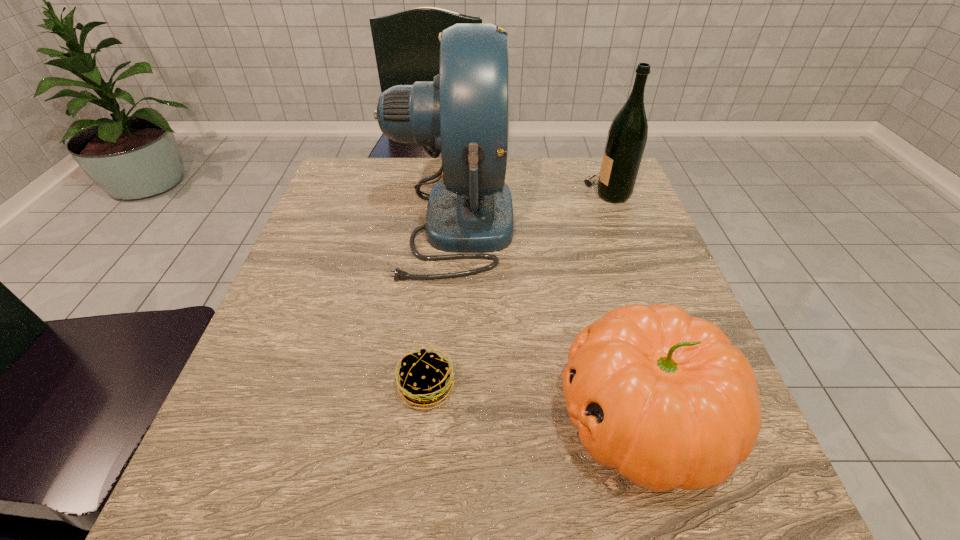
Locate an element on the screen. Image resolution: width=960 pixels, height=540 pixels. fan is located at coordinates [x=463, y=114].

You are a GUI agent. You are given a task and a screenshot of the screen. Output one action in this format:
    pyautogui.click(x=<x>, y=<y>)
    Task: Click on the second tallest object
    The image size is (960, 540).
    Given the screenshot: What is the action you would take?
    pyautogui.click(x=627, y=136)

Where is `pumpkin`? pumpkin is located at coordinates (665, 398).

Where is `the shortest object`? The width and height of the screenshot is (960, 540). the shortest object is located at coordinates pos(424,376).

Where is `free spot located in front of the tallest object to blow air`? free spot located in front of the tallest object to blow air is located at coordinates (606, 224).

Where is `vacant space situated on the left of the wine bottle`? vacant space situated on the left of the wine bottle is located at coordinates (497, 193).

Identify the location of free space located on the carved face of the pumpkin. (492, 416).

You are a GUI agent. You are given a task and a screenshot of the screen. Output one action in this format:
    pyautogui.click(x=<x>, y=<y>)
    Task: Click on the vacant space positioned on the carved face of the pumpkin
    The width and height of the screenshot is (960, 540).
    Given the screenshot: What is the action you would take?
    pyautogui.click(x=499, y=416)

Where is `free location located on the carved face of the pumpkin`? The height and width of the screenshot is (540, 960). free location located on the carved face of the pumpkin is located at coordinates (366, 416).

The image size is (960, 540). Identify the location of free spot located 0.280m on the back of the shortest object. coord(440,256).